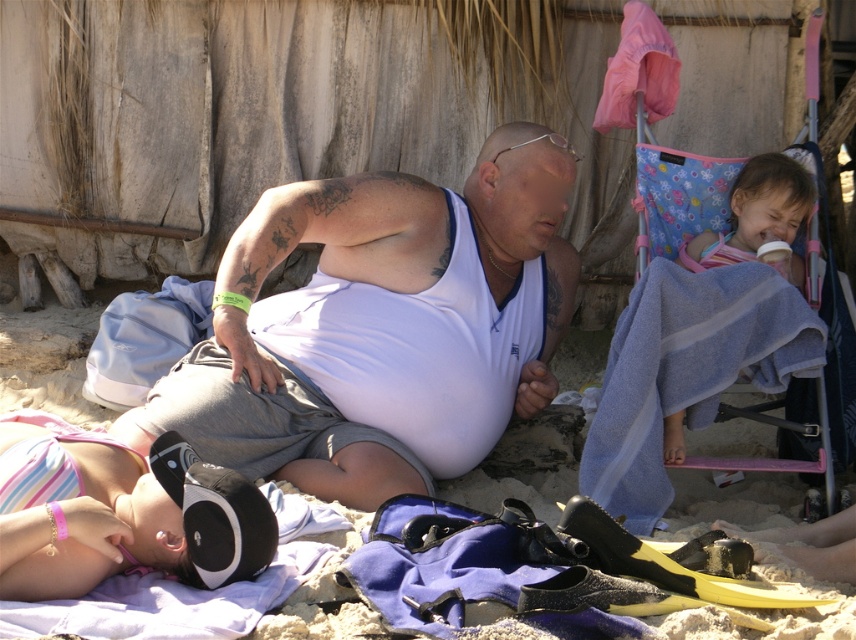
Question: Does pink fabric bikini top at lower left have a smaller size compared to striped fabric blanket at upper right?

Choices:
 (A) no
 (B) yes

Answer: (A)

Question: Can you confirm if white matte tank top at center is positioned above striped fabric blanket at upper right?

Choices:
 (A) no
 (B) yes

Answer: (A)

Question: Among these objects, which one is farthest from the camera?

Choices:
 (A) white matte tank top at center
 (B) pink fabric bikini top at lower left
 (C) striped fabric blanket at upper right
 (D) white matte towel at upper center

Answer: (C)

Question: Which of the following is the farthest from the observer?

Choices:
 (A) white matte towel at upper center
 (B) striped fabric blanket at upper right
 (C) pink fabric bikini top at lower left

Answer: (B)

Question: Can you confirm if white matte towel at upper center is positioned below striped fabric blanket at upper right?

Choices:
 (A) no
 (B) yes

Answer: (B)

Question: Considering the real-world distances, which object is closest to the white matte tank top at center?

Choices:
 (A) pink fabric bikini top at lower left
 (B) striped fabric blanket at upper right

Answer: (A)